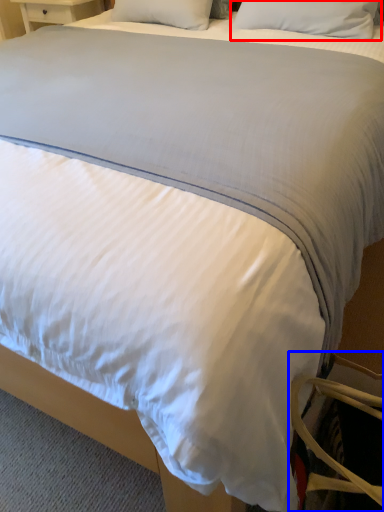
Question: Which point is closer to the camera, pillow (highlighted by a red box) or swivel chair (highlighted by a blue box)?

Choices:
 (A) pillow
 (B) swivel chair

Answer: (B)